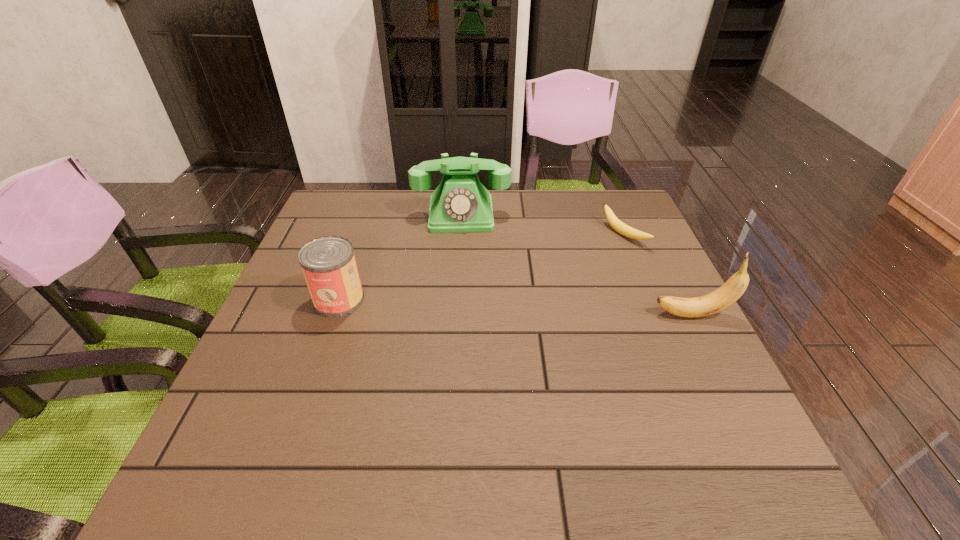
At what (x,y) coordinates should I click in order to perform the action: click on free space that satisfies the following two spatial constraints: 1. on the back side of the second shortest object; 2. on the right side of the third object from right to left. Please return your answer as a coordinate pair (x, y). Looking at the image, I should click on (369, 214).

Identify the location of free spot that satisfies the following two spatial constraints: 1. on the front side of the can; 2. at the start of the peel on the taller banana. (334, 315).

Locate an element on the screen. free space that satisfies the following two spatial constraints: 1. on the front side of the farther banana; 2. at the start of the peel on the taller banana is located at coordinates (658, 315).

You are a GUI agent. You are given a task and a screenshot of the screen. Output one action in this format:
    pyautogui.click(x=<x>, y=<y>)
    Task: Click on the free space in the image that satisfies the following two spatial constraints: 1. on the front side of the farther banana; 2. at the start of the peel on the taller banana
    The image size is (960, 540).
    Given the screenshot: What is the action you would take?
    [658, 315]

The height and width of the screenshot is (540, 960). I want to click on vacant space that satisfies the following two spatial constraints: 1. on the front side of the nearer banana; 2. at the start of the peel on the can, so click(334, 315).